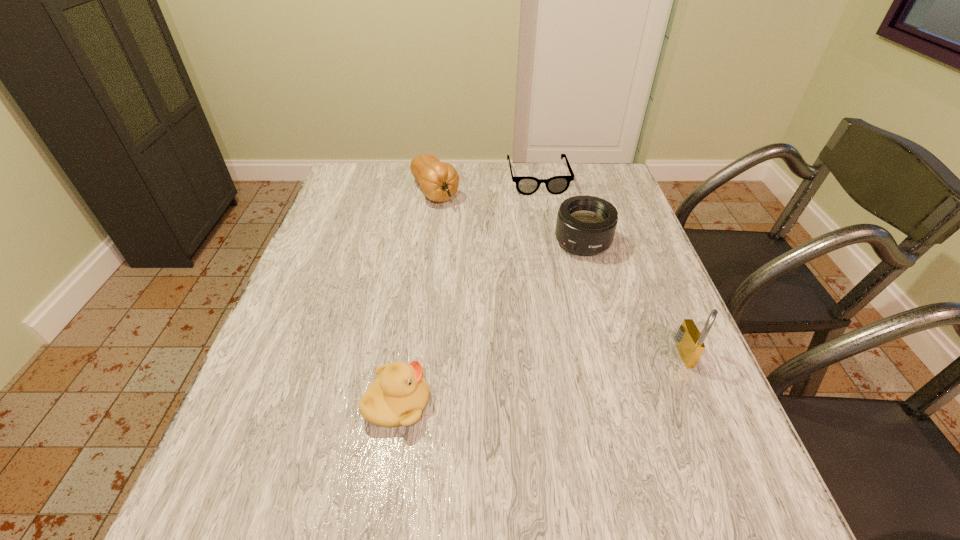
The width and height of the screenshot is (960, 540). I want to click on vacant space in between the gourd and the rightmost object, so [x=562, y=273].

This screenshot has height=540, width=960. Find the location of `blank region between the telephoto lens and the gourd`. blank region between the telephoto lens and the gourd is located at coordinates (509, 217).

You are a GUI agent. You are given a task and a screenshot of the screen. Output one action in this format:
    pyautogui.click(x=<x>, y=<y>)
    Task: Click on the blank region between the gourd and the duckling
    
    Given the screenshot: What is the action you would take?
    pyautogui.click(x=416, y=298)

The width and height of the screenshot is (960, 540). Find the location of `free area in between the spectacles and the gourd`. free area in between the spectacles and the gourd is located at coordinates (487, 185).

Where is `vacant area that lies between the third farthest object and the second nearest object`? vacant area that lies between the third farthest object and the second nearest object is located at coordinates (636, 298).

I want to click on unoccupied area between the gourd and the spectacles, so click(x=487, y=185).

Image resolution: width=960 pixels, height=540 pixels. I want to click on blank region between the padlock and the spectacles, so click(613, 266).

Locate an element on the screen. The width and height of the screenshot is (960, 540). object that is the third closest to the shortest object is located at coordinates (690, 342).

Locate an element on the screen. The height and width of the screenshot is (540, 960). object that stands as the closest to the spectacles is located at coordinates (439, 181).

This screenshot has height=540, width=960. Find the location of `vacant space that satisfies the following two spatial constraints: 1. on the front side of the gourd; 2. on the right side of the telephoto lens`. vacant space that satisfies the following two spatial constraints: 1. on the front side of the gourd; 2. on the right side of the telephoto lens is located at coordinates (428, 242).